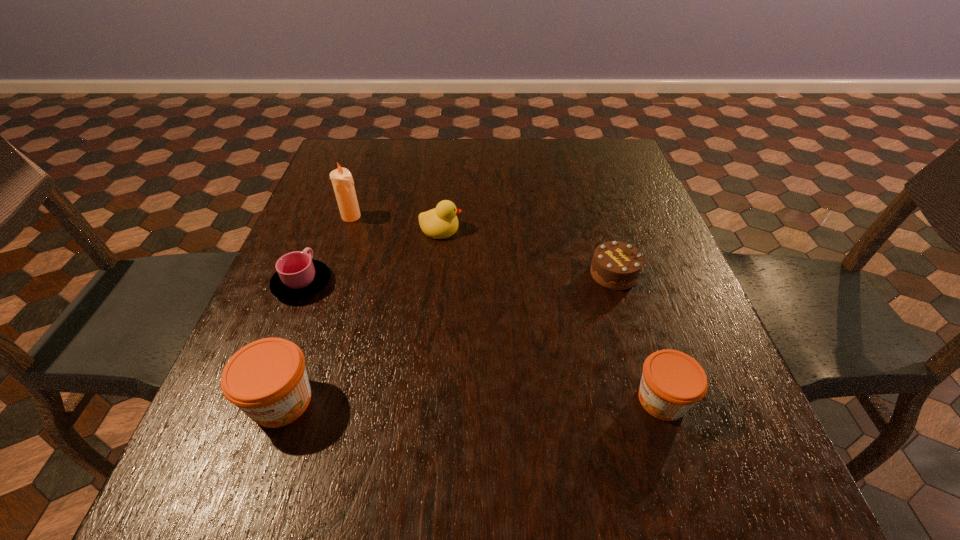
Image resolution: width=960 pixels, height=540 pixels. What are the coordinates of `vacant region located on the front of the candle` in the screenshot? It's located at [x=344, y=238].

The height and width of the screenshot is (540, 960). What are the coordinates of `vacant area situated 0.340m on the face of the third object from right to left` in the screenshot? It's located at (600, 228).

Find the location of a particular element. vacant area situated on the side with the handle of the cup is located at coordinates (333, 206).

Locate an element on the screen. This screenshot has height=540, width=960. vacant area situated 0.400m on the side with the handle of the cup is located at coordinates (348, 170).

Identify the location of free space located on the side with the handle of the cup. (337, 195).

You are a GUI agent. You are given a task and a screenshot of the screen. Output one action in this format:
    pyautogui.click(x=<x>, y=<y>)
    Task: Click on the vacant region located on the back of the chocolate cake
    This screenshot has height=540, width=960.
    Given the screenshot: What is the action you would take?
    pyautogui.click(x=581, y=167)

Find the location of `jam situated at the left edge`. jam situated at the left edge is located at coordinates (267, 379).

Locate an element on the screen. candle that is at the left edge is located at coordinates (342, 181).

Where is `cup that is at the left edge`? This screenshot has width=960, height=540. cup that is at the left edge is located at coordinates (298, 276).

This screenshot has width=960, height=540. Identify the location of jam that is at the right edge. (672, 382).